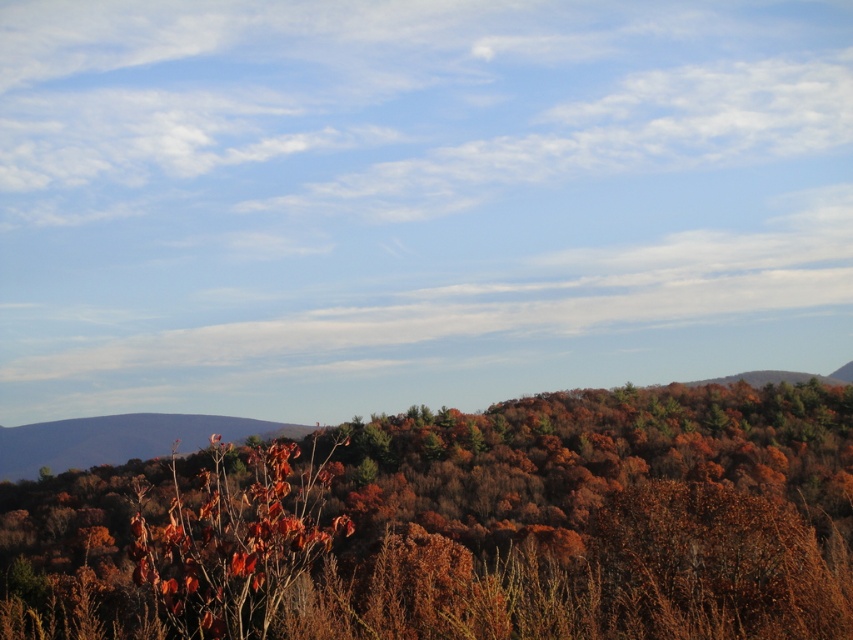
Can you confirm if brown matte tree at center is bigger than leathery brown leaves at center?

Yes, brown matte tree at center is bigger than leathery brown leaves at center.

From the picture: Can you confirm if brown matte tree at center is shorter than leathery brown leaves at center?

Incorrect, brown matte tree at center's height does not fall short of leathery brown leaves at center's.

Between point (587, 458) and point (242, 586), which one is positioned behind?

The point (587, 458) is more distant.

Locate an element on the screen. Image resolution: width=853 pixels, height=640 pixels. brown matte tree at center is located at coordinates (587, 518).